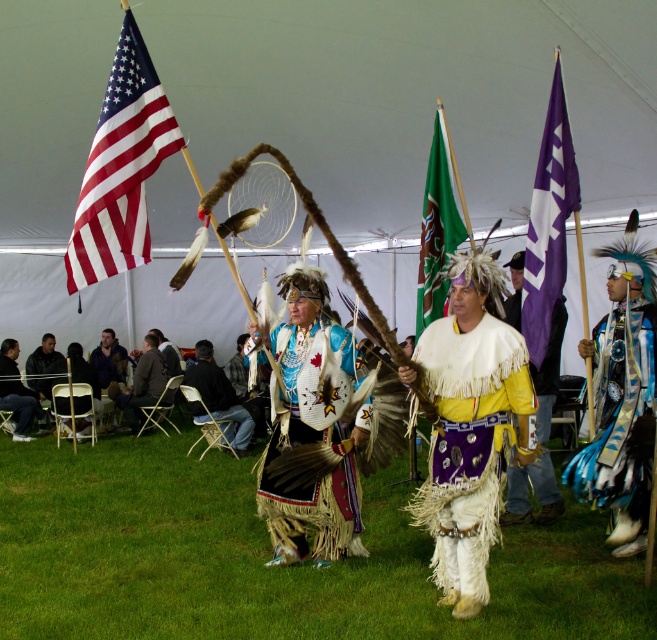
Question: Based on their relative distances, which object is farther from the red-white striped flag at upper left?

Choices:
 (A) green fabric flag at center
 (B) white fringed vest at center

Answer: (A)

Question: Which point appears farthest from the camera in this image?

Choices:
 (A) pos(528,317)
 (B) pos(645,394)

Answer: (A)

Question: Can you confirm if black leather jacket at center is smaller than dark brown leather jacket at lower left?

Choices:
 (A) no
 (B) yes

Answer: (A)

Question: Where is purple fabric flag at right located in relation to dark brown leather jacket at lower left in the image?

Choices:
 (A) above
 (B) below

Answer: (A)

Question: Among these objects, which one is nearest to the camera?

Choices:
 (A) red-white striped flag at upper left
 (B) denim jacket at lower left

Answer: (A)

Question: From the image, what is the correct spatial relationship of white fringed vest at center in relation to dark brown leather jacket at lower left?

Choices:
 (A) above
 (B) below

Answer: (B)